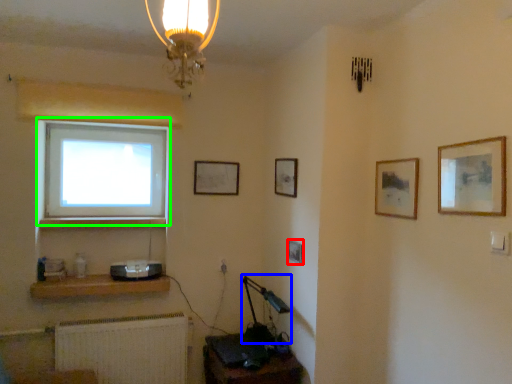
Question: Based on their relative distances, which object is nearer to picture frame (highlighted by a red box)? Choose from table lamp (highlighted by a blue box) and window (highlighted by a green box).

Choices:
 (A) table lamp
 (B) window

Answer: (A)